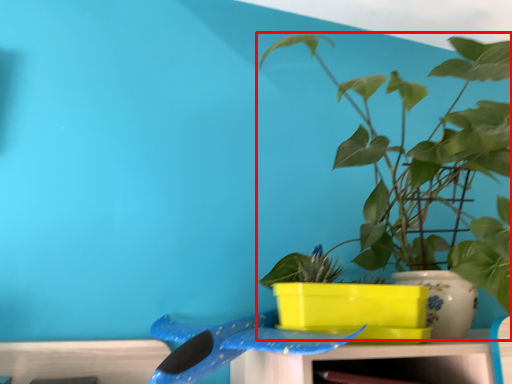
Question: From the image's perspective, considering the relative positions of houseplant (annotated by the red box) and whale in the image provided, where is houseplant (annotated by the red box) located with respect to the staircase?

Choices:
 (A) below
 (B) above

Answer: (B)